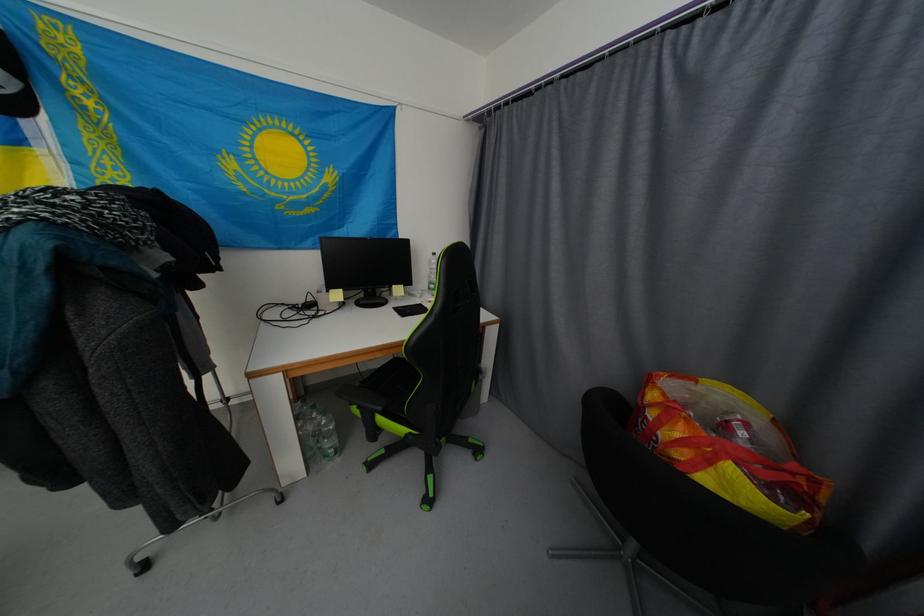
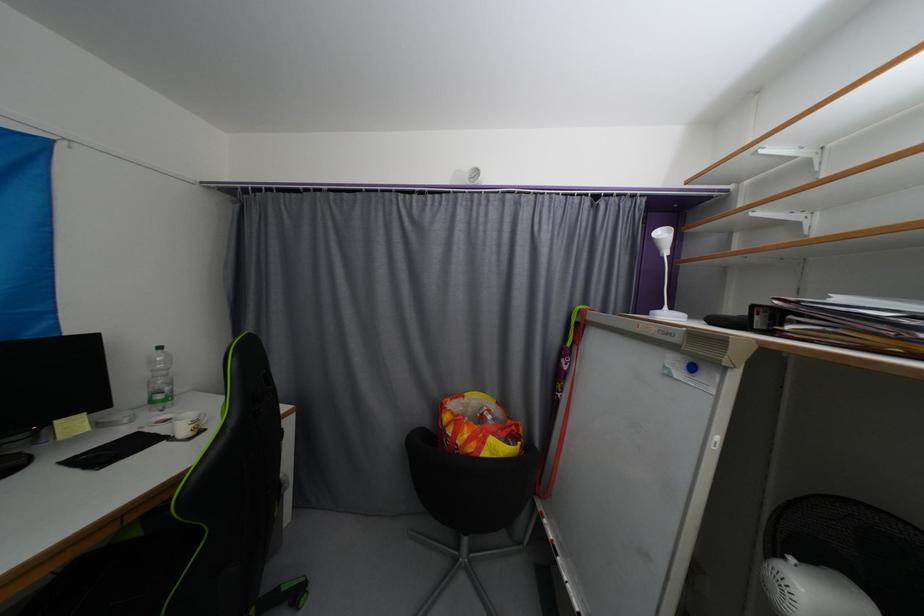
In the second image, find the point that corresponds to (x=434, y=291) in the first image.

(157, 403)